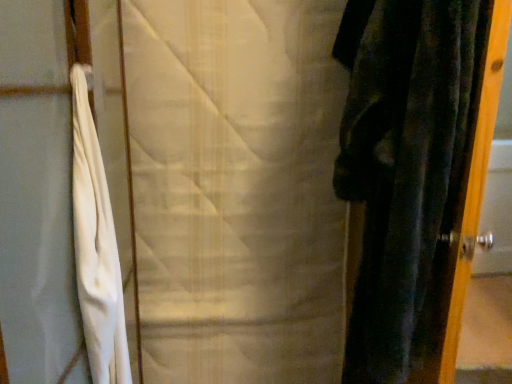
Question: Does velvet dark green curtain at right, the second curtain from the left, have a larger size compared to white textured fabric at center, the second curtain when ordered from right to left?

Choices:
 (A) no
 (B) yes

Answer: (A)

Question: Is velvet dark green curtain at right, which is the 1th curtain from right to left, surrounding white textured fabric at center, which ranks as the 1th curtain in left-to-right order?

Choices:
 (A) no
 (B) yes

Answer: (A)

Question: Does velvet dark green curtain at right, which is the 1th curtain from right to left, have a smaller size compared to white textured fabric at center, the second curtain when ordered from right to left?

Choices:
 (A) yes
 (B) no

Answer: (A)

Question: Is velvet dark green curtain at right, which is the 1th curtain from right to left, behind white textured fabric at center, the second curtain when ordered from right to left?

Choices:
 (A) no
 (B) yes

Answer: (A)

Question: Is velvet dark green curtain at right, the second curtain from the left, not near white textured fabric at center, the second curtain when ordered from right to left?

Choices:
 (A) no
 (B) yes

Answer: (A)

Question: From a real-world perspective, is velvet dark green curtain at right, which is the 1th curtain from right to left, below white textured fabric at center, the second curtain when ordered from right to left?

Choices:
 (A) no
 (B) yes

Answer: (A)

Question: Is white textured fabric at center, which ranks as the 1th curtain in left-to-right order, positioned with its back to velvet dark green curtain at right, the second curtain from the left?

Choices:
 (A) no
 (B) yes

Answer: (A)

Question: Considering the relative sizes of white textured fabric at center, which ranks as the 1th curtain in left-to-right order, and velvet dark green curtain at right, which is the 1th curtain from right to left, in the image provided, is white textured fabric at center, which ranks as the 1th curtain in left-to-right order, smaller than velvet dark green curtain at right, which is the 1th curtain from right to left,?

Choices:
 (A) yes
 (B) no

Answer: (B)

Question: Is white textured fabric at center, which ranks as the 1th curtain in left-to-right order, far away from velvet dark green curtain at right, the second curtain from the left?

Choices:
 (A) yes
 (B) no

Answer: (B)

Question: Are white textured fabric at center, which ranks as the 1th curtain in left-to-right order, and velvet dark green curtain at right, which is the 1th curtain from right to left, making contact?

Choices:
 (A) no
 (B) yes

Answer: (A)

Question: From a real-world perspective, is white textured fabric at center, which ranks as the 1th curtain in left-to-right order, over velvet dark green curtain at right, which is the 1th curtain from right to left?

Choices:
 (A) no
 (B) yes

Answer: (A)

Question: Considering the relative positions of white textured fabric at center, which ranks as the 1th curtain in left-to-right order, and velvet dark green curtain at right, which is the 1th curtain from right to left, in the image provided, is white textured fabric at center, which ranks as the 1th curtain in left-to-right order, behind velvet dark green curtain at right, which is the 1th curtain from right to left,?

Choices:
 (A) no
 (B) yes

Answer: (B)

Question: In terms of width, does velvet dark green curtain at right, the second curtain from the left, look wider or thinner when compared to white textured fabric at center, which ranks as the 1th curtain in left-to-right order?

Choices:
 (A) wide
 (B) thin

Answer: (A)